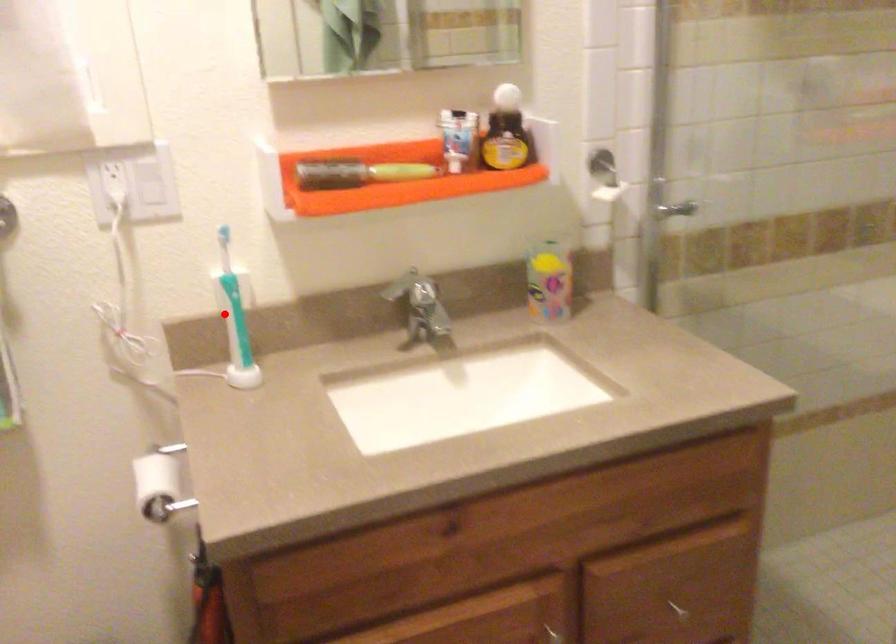
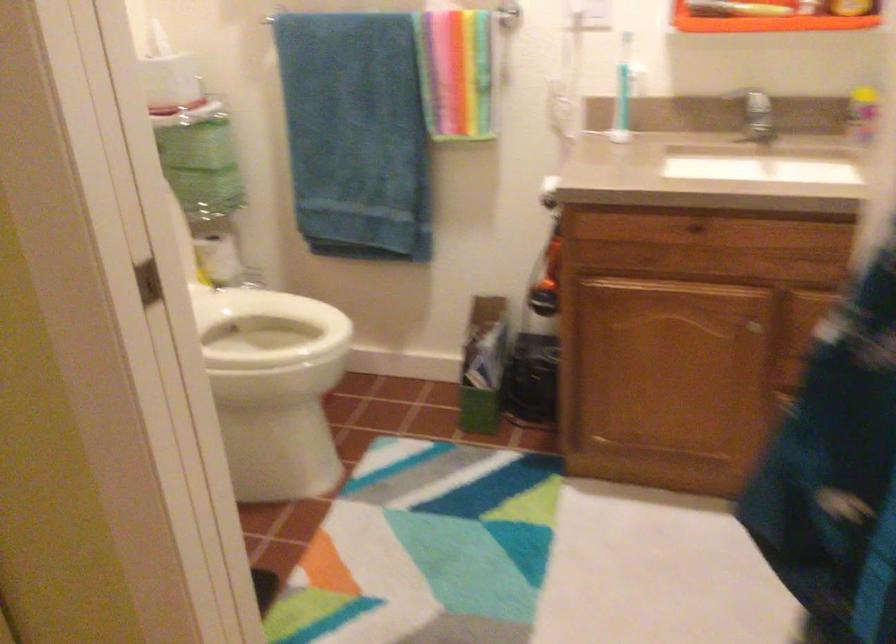
Question: A red point is marked in image1. In image2, is the corresponding 3D point closer to the camera or farther? Reply with the corresponding letter.

Choices:
 (A) The corresponding 3D point is closer.
 (B) The corresponding 3D point is farther.

Answer: (B)